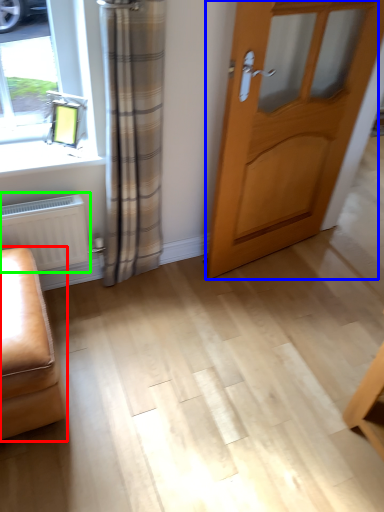
Question: Estimate the real-world distances between objects in this image. Which object is farther from furniture (highlighted by a red box), door (highlighted by a blue box) or radiator (highlighted by a green box)?

Choices:
 (A) door
 (B) radiator

Answer: (A)